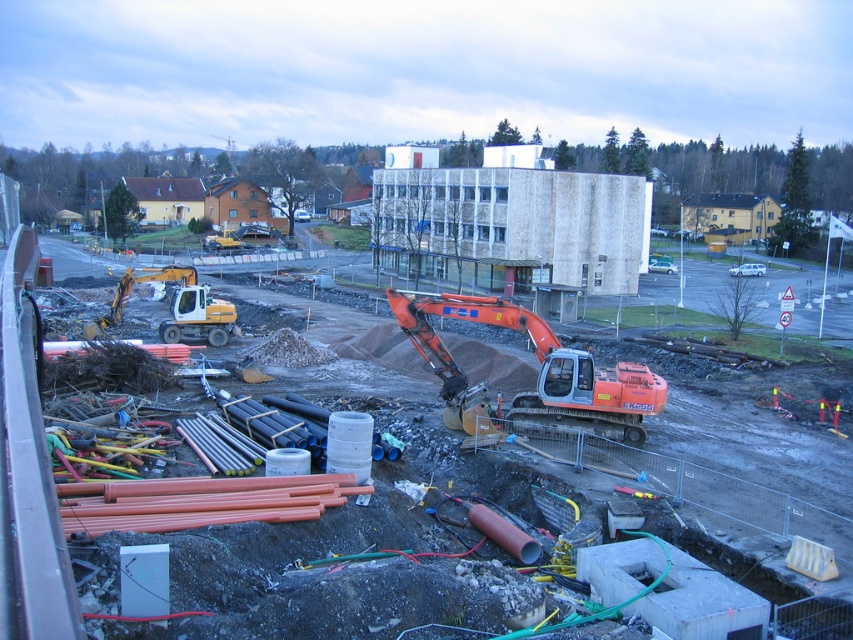
Question: Which point is closer to the camera taking this photo?

Choices:
 (A) (685, 499)
 (B) (183, 324)
 (C) (544, 401)

Answer: (A)

Question: Does orange metallic excavator at center have a smaller size compared to matte yellow excavator at center-left?

Choices:
 (A) yes
 (B) no

Answer: (A)

Question: Which of the following is the farthest from the observer?

Choices:
 (A) (456, 387)
 (B) (30, 614)
 (C) (192, 332)

Answer: (C)

Question: In this image, where is orange metallic excavator at center located relative to matte yellow excavator at center-left?

Choices:
 (A) above
 (B) below

Answer: (B)

Question: Does orange metallic pipes at center appear on the left side of matte yellow excavator at center-left?

Choices:
 (A) no
 (B) yes

Answer: (A)

Question: Which point is closer to the camera?

Choices:
 (A) (469, 401)
 (B) (84, 323)

Answer: (A)